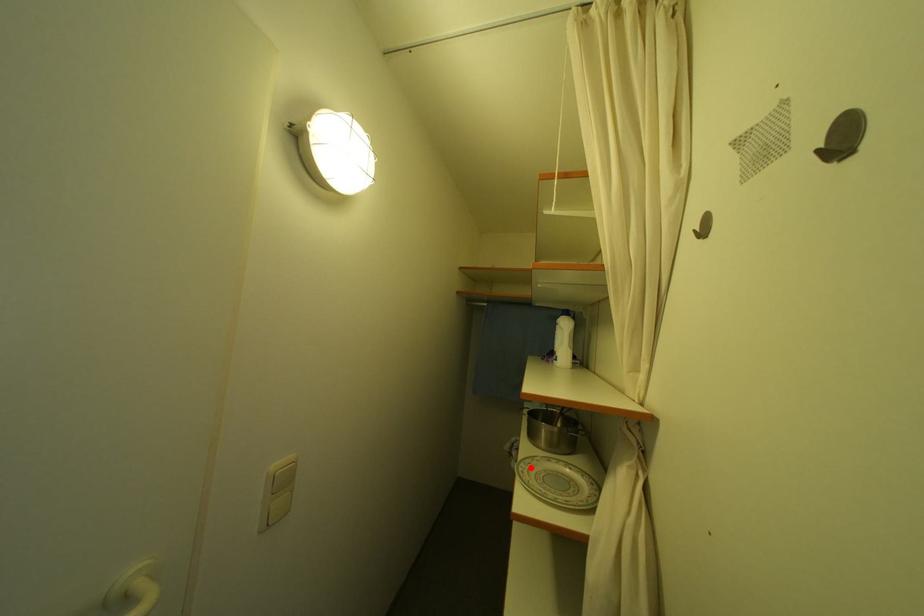
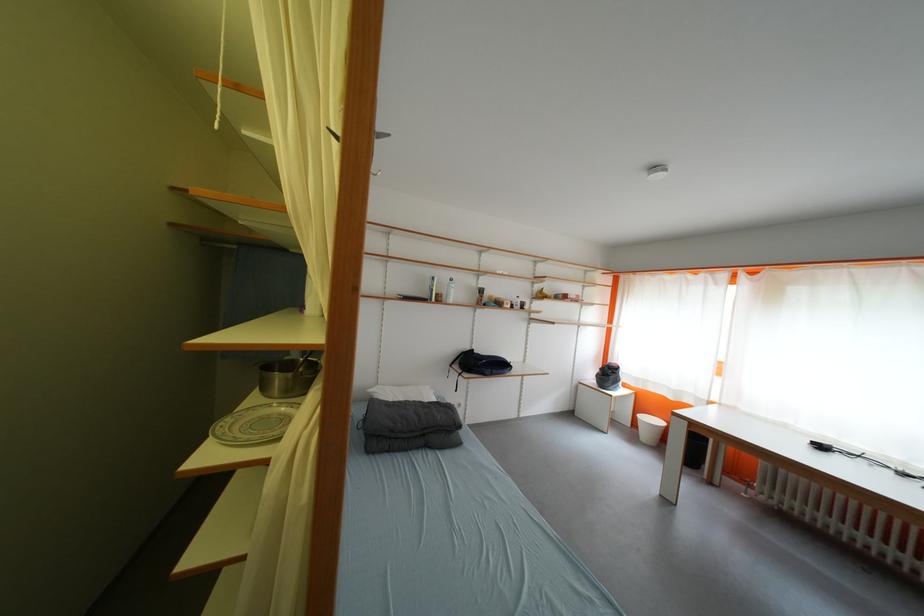
Question: I am providing you with two images of the same scene from different viewpoints. In image1, a red point is highlighted. Considering the same 3D point in image2, which of the following is correct?

Choices:
 (A) It is closer
 (B) It is farther

Answer: (B)